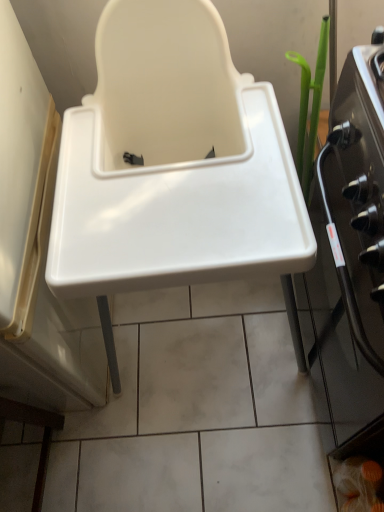
The image size is (384, 512). What do you see at coordinates (358, 237) in the screenshot?
I see `black glass oven at right` at bounding box center [358, 237].

Where is `black glass oven at right`? The width and height of the screenshot is (384, 512). black glass oven at right is located at coordinates (358, 237).

Identify the location of white plastic sink at center. This screenshot has width=384, height=512. (173, 162).

Describe the element at coordinates (173, 162) in the screenshot. I see `white plastic sink at center` at that location.

Locate an element on the screen. black glass oven at right is located at coordinates (358, 237).

Is black glass oven at right to the left of white plastic sink at center from the viewer's perspective?

Incorrect, black glass oven at right is not on the left side of white plastic sink at center.

Does black glass oven at right come in front of white plastic sink at center?

That is False.

Does point (354, 65) appear closer or farther from the camera than point (63, 150)?

Point (354, 65) is positioned closer to the camera compared to point (63, 150).

From the image's perspective, is black glass oven at right under white plastic sink at center?

Correct, black glass oven at right appears lower than white plastic sink at center in the image.

From a real-world perspective, which object rests below the other?

black glass oven at right is physically lower.

From the picture: Which object is wider, black glass oven at right or white plastic sink at center?

Wider between the two is white plastic sink at center.

Considering the sizes of objects black glass oven at right and white plastic sink at center in the image provided, who is taller, black glass oven at right or white plastic sink at center?

Standing taller between the two is white plastic sink at center.

Who is smaller, black glass oven at right or white plastic sink at center?

Smaller between the two is black glass oven at right.

Looking at this image, is black glass oven at right inside the boundaries of white plastic sink at center, or outside?

black glass oven at right is located beyond the bounds of white plastic sink at center.

Is black glass oven at right not near white plastic sink at center?

That's not correct — black glass oven at right is a little close to white plastic sink at center.

Is black glass oven at right facing towards white plastic sink at center?

Yes, black glass oven at right faces towards white plastic sink at center.

What's the angular difference between black glass oven at right and white plastic sink at center's facing directions?

They differ by 90.1 degrees in their facing directions.

Locate an element on the screen. oven directly beneath the white plastic sink at center (from a real-world perspective) is located at coordinates (358, 237).

Visually, is white plastic sink at center positioned to the left or to the right of black glass oven at right?

white plastic sink at center is to the left of black glass oven at right.

Considering the positions of objects white plastic sink at center and black glass oven at right in the image provided, who is in front, white plastic sink at center or black glass oven at right?

white plastic sink at center is in front.

Considering the points (111, 95) and (324, 194), which point is behind, point (111, 95) or point (324, 194)?

The point (111, 95) is behind.

From the picture: From the image's perspective, is white plastic sink at center located above or below black glass oven at right?

Based on their image positions, white plastic sink at center is located above black glass oven at right.

From a real-world perspective, is white plastic sink at center positioned under black glass oven at right based on gravity?

Actually, white plastic sink at center is physically above black glass oven at right in the real world.

Which of these two, white plastic sink at center or black glass oven at right, is thinner?

With smaller width is black glass oven at right.

Who is shorter, white plastic sink at center or black glass oven at right?

black glass oven at right.

In terms of size, does white plastic sink at center appear bigger or smaller than black glass oven at right?

white plastic sink at center is bigger than black glass oven at right.

Is black glass oven at right inside white plastic sink at center?

No, black glass oven at right is not surrounded by white plastic sink at center.

Would you consider white plastic sink at center to be distant from black glass oven at right?

No, there isn't a large distance between white plastic sink at center and black glass oven at right.

Could you tell me if white plastic sink at center is facing black glass oven at right?

No, white plastic sink at center does not turn towards black glass oven at right.

How distant is white plastic sink at center from black glass oven at right?

white plastic sink at center and black glass oven at right are 10.77 inches apart from each other.

Find the location of a particular element. This screenshot has height=512, width=384. oven behind the white plastic sink at center is located at coordinates (358, 237).

I want to click on sink on the left of black glass oven at right, so click(173, 162).

Locate an element on the screen. The width and height of the screenshot is (384, 512). oven that appears behind the white plastic sink at center is located at coordinates (358, 237).